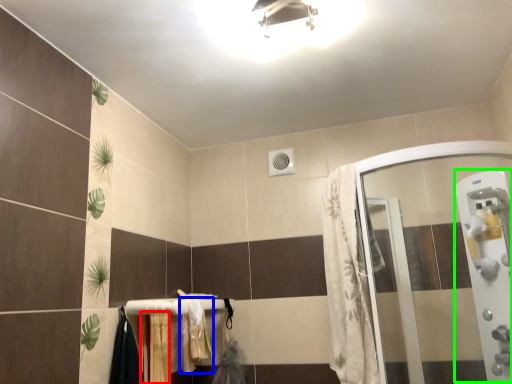
Question: Which object is positioned farthest from curtain (highlighted by a red box)? Select from bath towel (highlighted by a blue box) and screen door (highlighted by a green box).

Choices:
 (A) bath towel
 (B) screen door

Answer: (B)